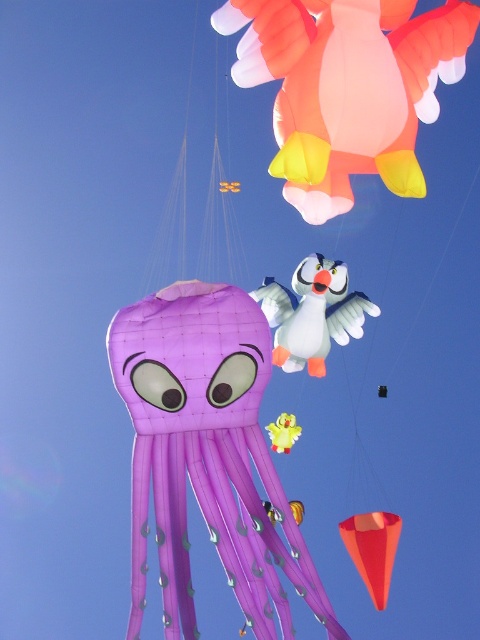
You are a kite enthusiast observing the scene. You notice the matte orange duck at upper center and the white glossy bird at center. If you want to fly a new kite between these two existing kites, how much space is available between them?

There is a distance of 23.15 feet between the matte orange duck at upper center and the white glossy bird at center, so you can fly a new kite in that space.

You are a kite enthusiast observing the scene. You notice the matte orange duck at upper center and the white glossy bird at center. Which of these two kites has a greater width?

The matte orange duck at upper center has a greater width than the white glossy bird at center.